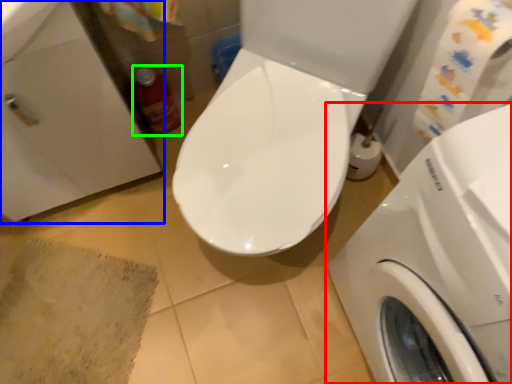
Question: Based on their relative distances, which object is farther from washing machine (highlighted by a red box)? Choose from sink (highlighted by a blue box) and cleaning product (highlighted by a green box).

Choices:
 (A) sink
 (B) cleaning product

Answer: (B)